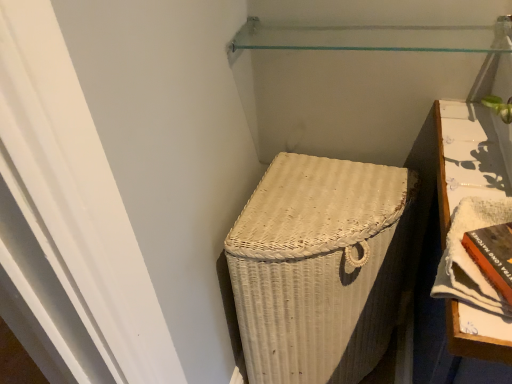
Question: Considering the relative positions of orange hardcover book at right, marked as the second book in a left-to-right arrangement, and orange hardcover book at lower right, which appears as the 1th book when viewed from the left, in the image provided, is orange hardcover book at right, marked as the second book in a left-to-right arrangement, in front of orange hardcover book at lower right, which appears as the 1th book when viewed from the left,?

Choices:
 (A) yes
 (B) no

Answer: (A)

Question: Is the position of orange hardcover book at right, positioned as the 1th book in right-to-left order, more distant than that of orange hardcover book at lower right, which appears as the 1th book when viewed from the left?

Choices:
 (A) no
 (B) yes

Answer: (A)

Question: Can you confirm if orange hardcover book at right, positioned as the 1th book in right-to-left order, is positioned to the left of orange hardcover book at lower right, which appears as the 1th book when viewed from the left?

Choices:
 (A) no
 (B) yes

Answer: (A)

Question: From a real-world perspective, is orange hardcover book at right, positioned as the 1th book in right-to-left order, physically below orange hardcover book at lower right, the 2th book from the right?

Choices:
 (A) no
 (B) yes

Answer: (A)

Question: From the image's perspective, would you say orange hardcover book at right, positioned as the 1th book in right-to-left order, is shown under orange hardcover book at lower right, which appears as the 1th book when viewed from the left?

Choices:
 (A) yes
 (B) no

Answer: (B)

Question: From the image's perspective, is transparent glass shelf at upper center located above or below orange hardcover book at right, marked as the second book in a left-to-right arrangement?

Choices:
 (A) below
 (B) above

Answer: (B)

Question: Considering their positions, is transparent glass shelf at upper center located in front of or behind orange hardcover book at right, positioned as the 1th book in right-to-left order?

Choices:
 (A) front
 (B) behind

Answer: (B)

Question: Would you say transparent glass shelf at upper center is inside or outside orange hardcover book at right, positioned as the 1th book in right-to-left order?

Choices:
 (A) inside
 (B) outside

Answer: (B)

Question: From a real-world perspective, is transparent glass shelf at upper center positioned above or below orange hardcover book at right, marked as the second book in a left-to-right arrangement?

Choices:
 (A) above
 (B) below

Answer: (A)

Question: Looking at their shapes, would you say transparent glass shelf at upper center is wider or thinner than orange hardcover book at lower right, the 2th book from the right?

Choices:
 (A) wide
 (B) thin

Answer: (A)

Question: Is transparent glass shelf at upper center taller or shorter than orange hardcover book at lower right, the 2th book from the right?

Choices:
 (A) tall
 (B) short

Answer: (B)

Question: Based on their sizes in the image, would you say transparent glass shelf at upper center is bigger or smaller than orange hardcover book at lower right, the 2th book from the right?

Choices:
 (A) big
 (B) small

Answer: (A)

Question: From a real-world perspective, is transparent glass shelf at upper center positioned above or below orange hardcover book at lower right, the 2th book from the right?

Choices:
 (A) above
 (B) below

Answer: (A)

Question: From a real-world perspective, is orange hardcover book at lower right, the 2th book from the right, physically located above or below transparent glass shelf at upper center?

Choices:
 (A) below
 (B) above

Answer: (A)

Question: Is point (504, 261) positioned closer to the camera than point (265, 44)?

Choices:
 (A) farther
 (B) closer

Answer: (B)